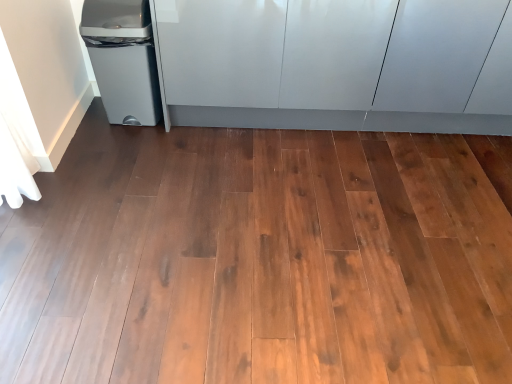
The height and width of the screenshot is (384, 512). Identify the location of glossy white cabinetry at upper center. (337, 64).

This screenshot has height=384, width=512. Find the location of `waste container behind the glossy white cabinetry at upper center`. waste container behind the glossy white cabinetry at upper center is located at coordinates [123, 59].

Does matte gray plastic trash can at left lie behind glossy white cabinetry at upper center?

Yes, matte gray plastic trash can at left is further from the camera.

Which is nearer, (122, 92) or (293, 25)?

The point (293, 25) is more forward.

How distant is matte gray plastic trash can at left from glossy white cabinetry at upper center?

matte gray plastic trash can at left is 21.29 inches away from glossy white cabinetry at upper center.

Is matte gray plastic trash can at left beside white fabric curtain at left?

No, matte gray plastic trash can at left is not beside white fabric curtain at left.

From the image's perspective, which one is positioned lower, matte gray plastic trash can at left or white fabric curtain at left?

white fabric curtain at left, from the image's perspective.

Based on the photo, is matte gray plastic trash can at left closer to the viewer compared to white fabric curtain at left?

No, it is not.

Which is correct: matte gray plastic trash can at left is inside white fabric curtain at left, or outside of it?

The correct answer is: outside.

Are glossy white cabinetry at upper center and matte gray plastic trash can at left beside each other?

No, glossy white cabinetry at upper center is not making contact with matte gray plastic trash can at left.

From the image's perspective, relative to matte gray plastic trash can at left, is glossy white cabinetry at upper center above or below?

Based on their image positions, glossy white cabinetry at upper center is located above matte gray plastic trash can at left.

In terms of height, does glossy white cabinetry at upper center look taller or shorter compared to matte gray plastic trash can at left?

Considering their sizes, glossy white cabinetry at upper center has more height than matte gray plastic trash can at left.

Is glossy white cabinetry at upper center outside of white fabric curtain at left?

Indeed, glossy white cabinetry at upper center is completely outside white fabric curtain at left.

Does glossy white cabinetry at upper center appear on the left side of white fabric curtain at left?

No, glossy white cabinetry at upper center is not to the left of white fabric curtain at left.

Considering the sizes of glossy white cabinetry at upper center and white fabric curtain at left in the image, is glossy white cabinetry at upper center taller or shorter than white fabric curtain at left?

In the image, glossy white cabinetry at upper center appears to be shorter than white fabric curtain at left.

From the picture: From a real-world perspective, is glossy white cabinetry at upper center located higher than white fabric curtain at left?

Actually, glossy white cabinetry at upper center is physically below white fabric curtain at left in the real world.

How different are the orientations of white fabric curtain at left and matte gray plastic trash can at left in degrees?

The facing directions of white fabric curtain at left and matte gray plastic trash can at left are 90.6 degrees apart.

Is white fabric curtain at left bigger than matte gray plastic trash can at left?

Yes, white fabric curtain at left is bigger than matte gray plastic trash can at left.

Based on the photo, does white fabric curtain at left lie behind matte gray plastic trash can at left?

That is False.

Which is more to the left, white fabric curtain at left or matte gray plastic trash can at left?

white fabric curtain at left is more to the left.

Which object is thinner, white fabric curtain at left or glossy white cabinetry at upper center?

white fabric curtain at left.

How many degrees apart are the facing directions of white fabric curtain at left and glossy white cabinetry at upper center?

89.5 degrees.

Considering the positions of objects white fabric curtain at left and glossy white cabinetry at upper center in the image provided, who is more to the right, white fabric curtain at left or glossy white cabinetry at upper center?

glossy white cabinetry at upper center.

Looking at this image, is white fabric curtain at left smaller than glossy white cabinetry at upper center?

Indeed, white fabric curtain at left has a smaller size compared to glossy white cabinetry at upper center.

Image resolution: width=512 pixels, height=384 pixels. In order to click on cabinetry above the matte gray plastic trash can at left (from a real-world perspective) in this screenshot , I will do `click(337, 64)`.

The height and width of the screenshot is (384, 512). I want to click on waste container that appears on the right of white fabric curtain at left, so [123, 59].

When comparing their distances from white fabric curtain at left, does glossy white cabinetry at upper center or matte gray plastic trash can at left seem further?

Among the two, glossy white cabinetry at upper center is located further to white fabric curtain at left.

Looking at the image, which one is located further to white fabric curtain at left, matte gray plastic trash can at left or glossy white cabinetry at upper center?

The object further to white fabric curtain at left is glossy white cabinetry at upper center.

When comparing their distances from matte gray plastic trash can at left, does glossy white cabinetry at upper center or white fabric curtain at left seem further?

glossy white cabinetry at upper center.

Based on their spatial positions, is white fabric curtain at left or matte gray plastic trash can at left closer to glossy white cabinetry at upper center?

Among the two, matte gray plastic trash can at left is located nearer to glossy white cabinetry at upper center.

Considering their positions, is matte gray plastic trash can at left positioned further to glossy white cabinetry at upper center than white fabric curtain at left?

white fabric curtain at left lies further to glossy white cabinetry at upper center than the other object.

From the image, which object appears to be nearer to matte gray plastic trash can at left, white fabric curtain at left or glossy white cabinetry at upper center?

white fabric curtain at left lies closer to matte gray plastic trash can at left than the other object.

In order to click on waste container between white fabric curtain at left and glossy white cabinetry at upper center in the horizontal direction in this screenshot , I will do [123, 59].